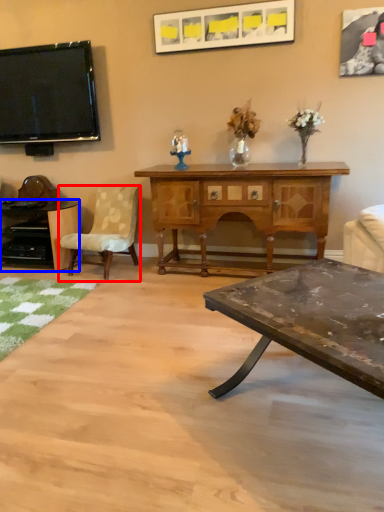
Question: Among these objects, which one is farthest to the camera, chair (highlighted by a red box) or desk (highlighted by a blue box)?

Choices:
 (A) chair
 (B) desk

Answer: (B)